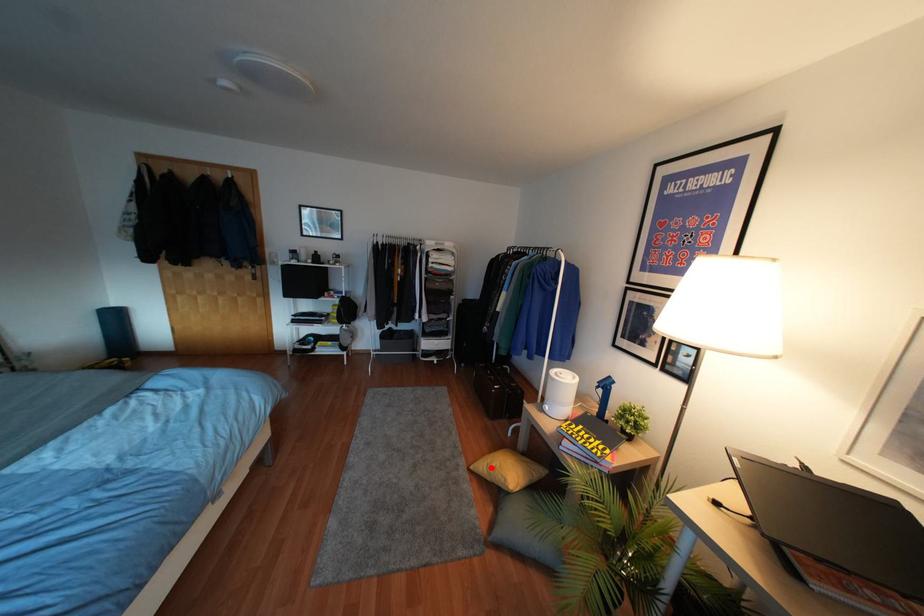
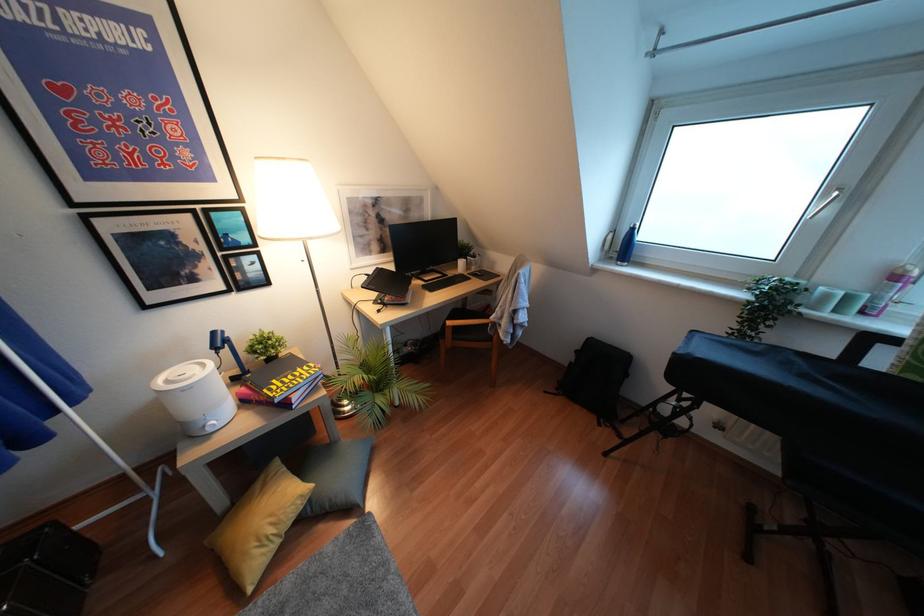
Locate, in the second image, the point that corresponds to the highlighted location in the first image.

(271, 530)